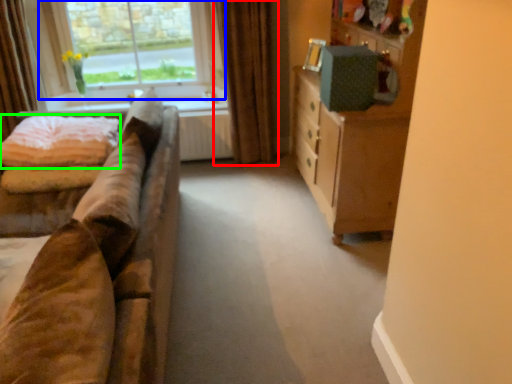
Question: Which is nearer to the curtain (highlighted by a red box)? window (highlighted by a blue box) or quilt (highlighted by a green box).

Choices:
 (A) window
 (B) quilt

Answer: (A)